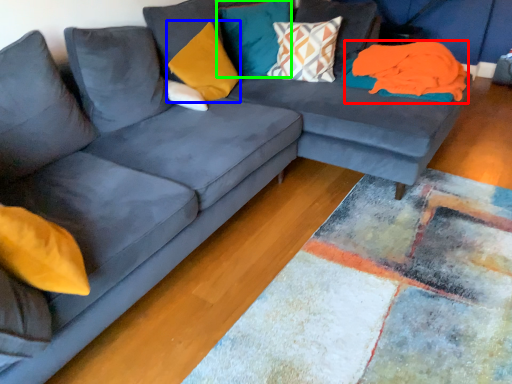
Question: Which object is positioned closest to material (highlighted by a red box)? Select from pillow (highlighted by a blue box) and pillow (highlighted by a green box).

Choices:
 (A) pillow
 (B) pillow

Answer: (B)